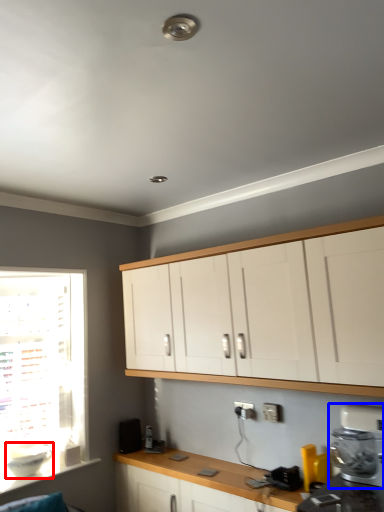
Question: Which of the following is the farthest to the observer, appliance (highlighted by a red box) or kitchen appliance (highlighted by a blue box)?

Choices:
 (A) appliance
 (B) kitchen appliance

Answer: (A)